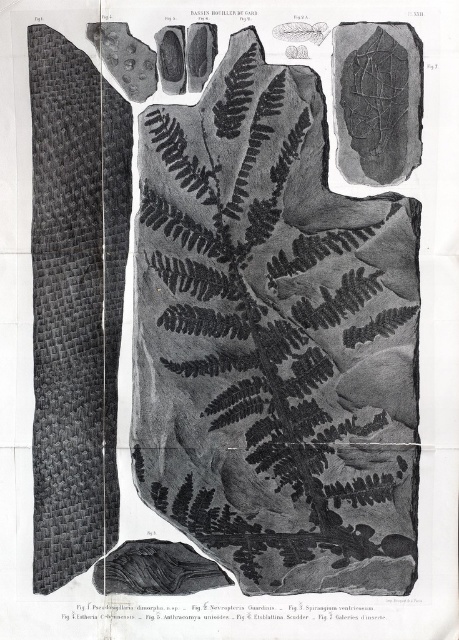
Question: Which object appears farthest from the camera in this image?

Choices:
 (A) black textured fern at center
 (B) smooth gray rock at upper right

Answer: (A)

Question: Can you confirm if black textured fern at center is bigger than smooth gray rock at upper right?

Choices:
 (A) yes
 (B) no

Answer: (A)

Question: Is black textured fern at center bigger than smooth gray rock at upper right?

Choices:
 (A) no
 (B) yes

Answer: (B)

Question: Which point is farther from the camera taking this photo?

Choices:
 (A) (154, 492)
 (B) (373, 141)

Answer: (A)

Question: Is black textured fern at center positioned behind smooth gray rock at upper right?

Choices:
 (A) no
 (B) yes

Answer: (B)